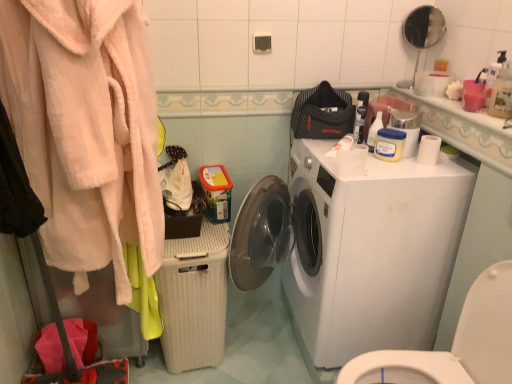
Question: Considering the relative sizes of translucent plastic spray bottle at upper right, which is counted as the 2th cleaning product, starting from the left, and white glossy washing machine at center in the image provided, is translucent plastic spray bottle at upper right, which is counted as the 2th cleaning product, starting from the left, taller than white glossy washing machine at center?

Choices:
 (A) yes
 (B) no

Answer: (B)

Question: From the image's perspective, does translucent plastic spray bottle at upper right, which appears as the 2th cleaning product when viewed from the back, appear higher than white glossy washing machine at center?

Choices:
 (A) no
 (B) yes

Answer: (B)

Question: Does translucent plastic spray bottle at upper right, which is counted as the 1th cleaning product, starting from the front, lie behind white glossy washing machine at center?

Choices:
 (A) no
 (B) yes

Answer: (A)

Question: Can white glossy washing machine at center be found inside translucent plastic spray bottle at upper right, acting as the first cleaning product starting from the right?

Choices:
 (A) yes
 (B) no

Answer: (B)

Question: Can you confirm if translucent plastic spray bottle at upper right, which appears as the 2th cleaning product when viewed from the back, is smaller than white glossy washing machine at center?

Choices:
 (A) no
 (B) yes

Answer: (B)

Question: Is translucent plastic spray bottle at upper right, which is counted as the 2th cleaning product, starting from the left, looking in the opposite direction of white glossy washing machine at center?

Choices:
 (A) yes
 (B) no

Answer: (B)

Question: Is translucent plastic spray bottle at upper right, which appears as the 2th cleaning product when viewed from the back, closer to the viewer compared to white plastic washer at right?

Choices:
 (A) no
 (B) yes

Answer: (A)

Question: Are translucent plastic spray bottle at upper right, which appears as the 2th cleaning product when viewed from the back, and white plastic washer at right located far from each other?

Choices:
 (A) yes
 (B) no

Answer: (B)

Question: Is translucent plastic spray bottle at upper right, which appears as the 2th cleaning product when viewed from the back, turned away from white plastic washer at right?

Choices:
 (A) no
 (B) yes

Answer: (A)

Question: Can you confirm if translucent plastic spray bottle at upper right, which appears as the 2th cleaning product when viewed from the back, is wider than white plastic washer at right?

Choices:
 (A) no
 (B) yes

Answer: (A)

Question: Does translucent plastic spray bottle at upper right, acting as the first cleaning product starting from the right, come behind white plastic washer at right?

Choices:
 (A) no
 (B) yes

Answer: (B)

Question: Would you say translucent plastic spray bottle at upper right, acting as the first cleaning product starting from the right, is outside white plastic washer at right?

Choices:
 (A) yes
 (B) no

Answer: (A)

Question: Does soft pink plush robe at left have a greater height compared to beige wicker basket at lower center?

Choices:
 (A) yes
 (B) no

Answer: (A)